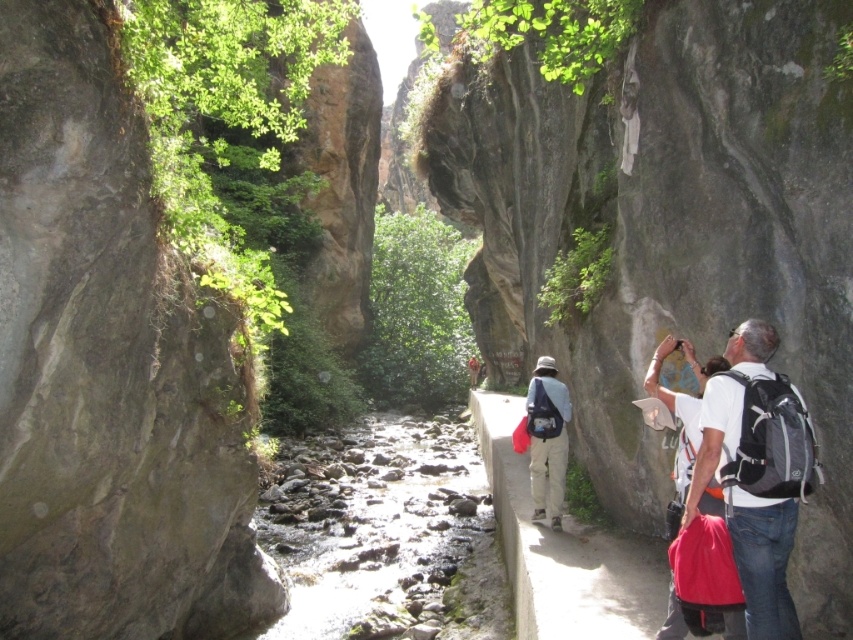
You are a hiker planning to cross the narrow canyon. You see the white fabric backpack at right and the khaki fabric pants at center. Which item takes up more space in your view?

The white fabric backpack at right is bigger than the khaki fabric pants at center, so it takes up more space in your view.

You are a hiker planning to cross the narrow canyon. You see a white fabric backpack at right and a khaki fabric pants at center. Which object is taller?

The white fabric backpack at right is much taller than the khaki fabric pants at center.

You are hiking in the canyon and need to move your khaki fabric pants at center to the white fabric backpack at right. Which direction should you move in?

You should move to the right because the white fabric backpack at right is to the right of the khaki fabric pants at center.